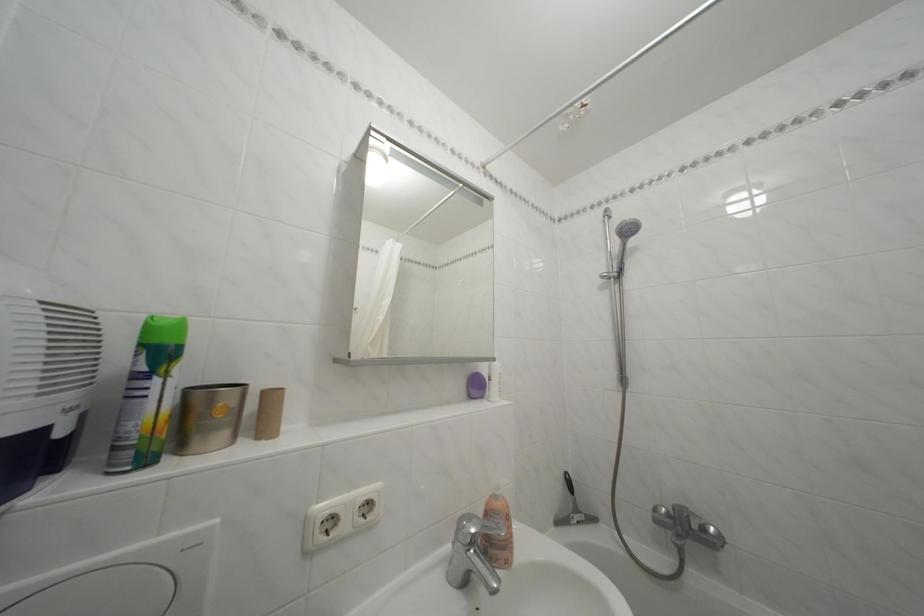
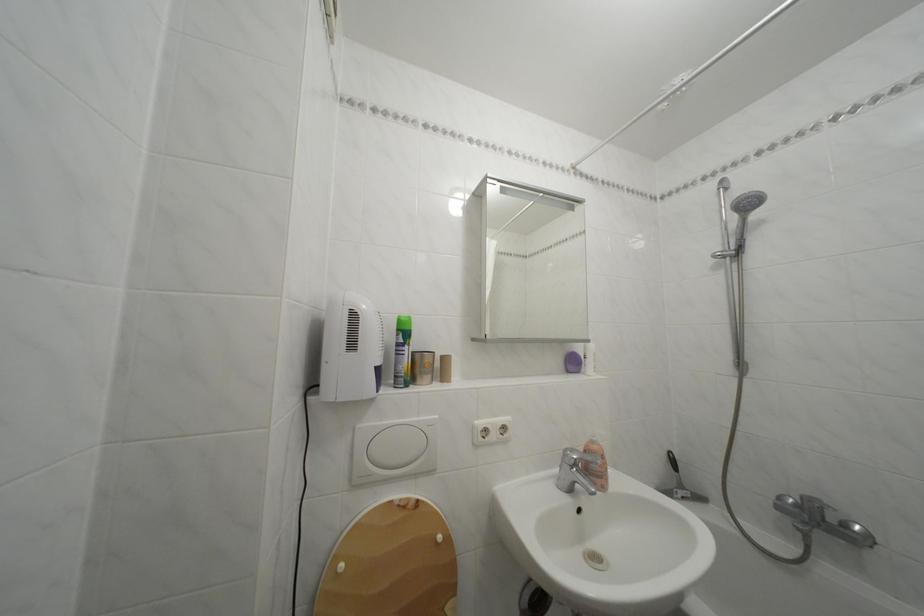
Where in the second image is the point corresponding to point 479,525 from the first image?

(581, 456)